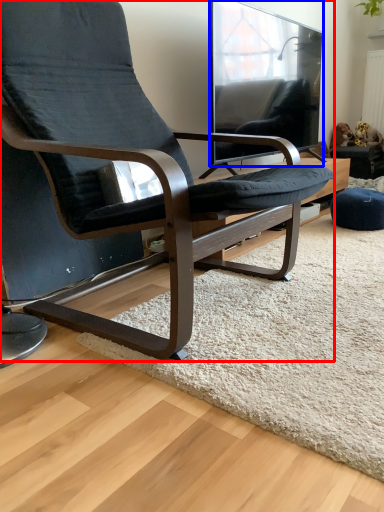
Question: Which point is closer to the camera, chair (highlighted by a red box) or window (highlighted by a blue box)?

Choices:
 (A) chair
 (B) window

Answer: (A)